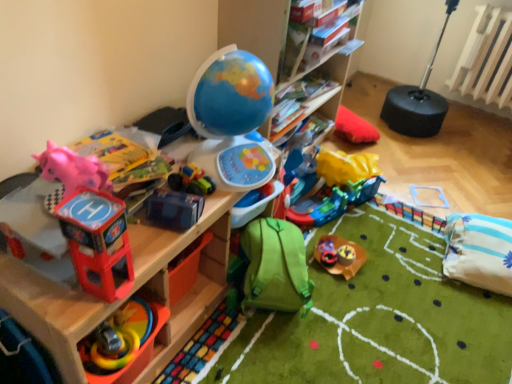
Identify the location of vacant area that is in front of shiny metallic toy car at center, which ranks as the 1th toy in right-to-left order. The height and width of the screenshot is (384, 512). (349, 271).